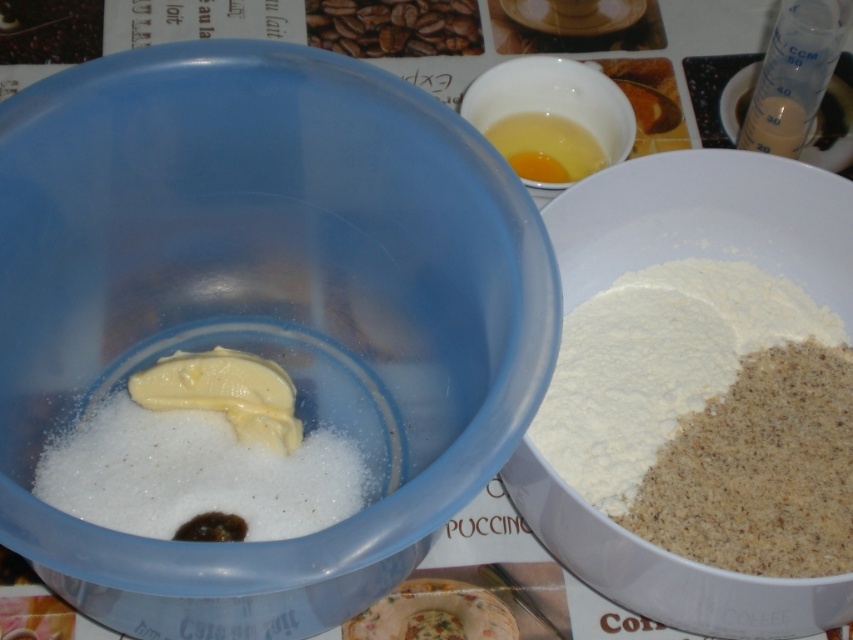
Between translucent plastic bowl at center and white powdery flour at right, which one has less height?

Standing shorter between the two is white powdery flour at right.

From the picture: Can you confirm if translucent plastic bowl at center is positioned above white powdery flour at right?

Indeed, translucent plastic bowl at center is positioned over white powdery flour at right.

Is point (515, 259) positioned after point (666, 275)?

No, (515, 259) is closer to viewer.

Identify the location of translucent plastic bowl at center. pos(262,301).

Does white matte bowl at right have a lesser width compared to translucent glass bowl at upper center?

No, white matte bowl at right is not thinner than translucent glass bowl at upper center.

Can you confirm if white matte bowl at right is positioned below translucent glass bowl at upper center?

Yes.

Which is in front, point (607, 554) or point (601, 96)?

Positioned in front is point (607, 554).

Find the location of a particular element. The height and width of the screenshot is (640, 853). white matte bowl at right is located at coordinates (706, 221).

Who is more distant from viewer, (173, 154) or (564, 564)?

Positioned behind is point (564, 564).

Is point (83, 275) farther from viewer compared to point (703, 164)?

That is False.

Find the location of a particular element. This screenshot has width=853, height=640. translucent plastic bowl at center is located at coordinates (262, 301).

Where is `translucent plastic bowl at center`? The image size is (853, 640). translucent plastic bowl at center is located at coordinates (262, 301).